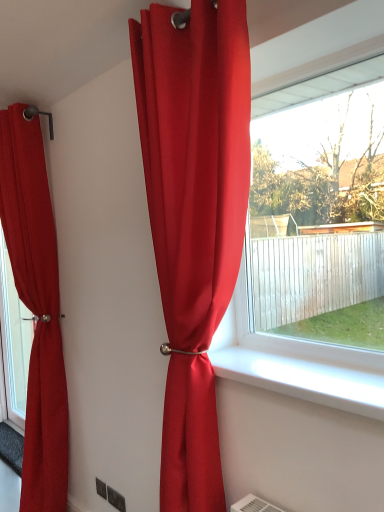
This screenshot has height=512, width=384. I want to click on blank space above white smooth window sill at center (from a real-world perspective), so click(322, 369).